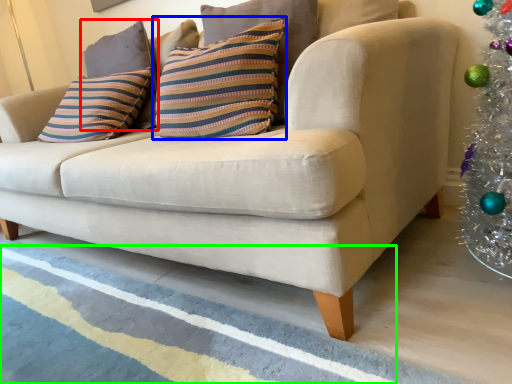
Question: Based on their relative distances, which object is nearer to pillow (highlighted by a red box)? Choose from pillow (highlighted by a blue box) and stripe (highlighted by a green box).

Choices:
 (A) pillow
 (B) stripe

Answer: (A)